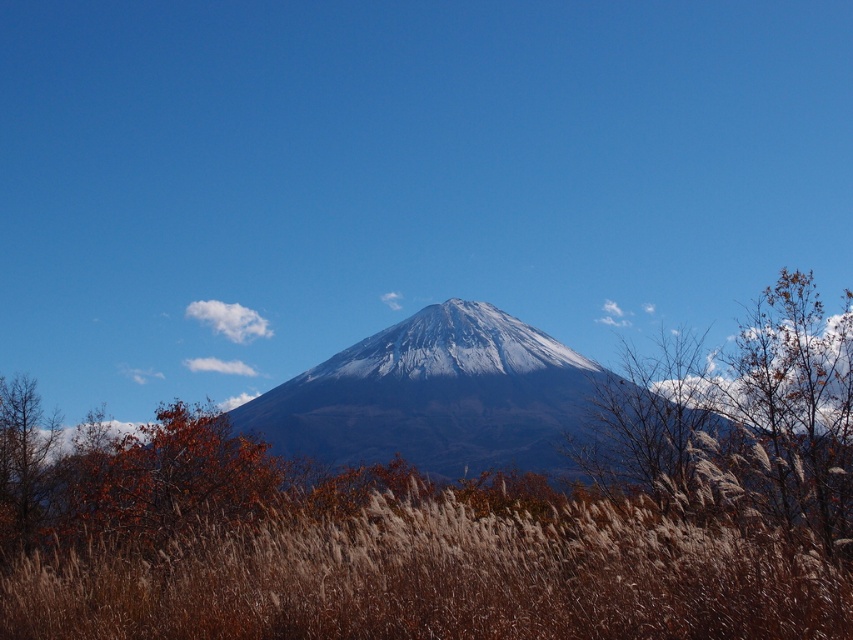
You are a photographer trying to capture the mountain in the background. You notice two objects in the foreground, the brown grass at center and the brown matte tree at center. Which one would appear closer to the camera if you focus on the mountain?

The brown grass at center would appear closer to the camera than the brown matte tree at center because it has a larger size in the image.